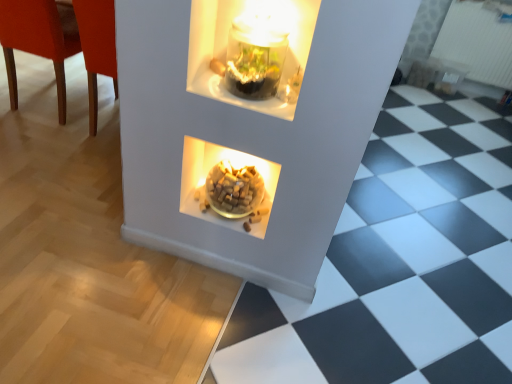
Question: Considering the relative positions of translucent glass bowl at center and matte wood chair at left in the image provided, is translucent glass bowl at center to the left or to the right of matte wood chair at left?

Choices:
 (A) left
 (B) right

Answer: (B)

Question: Considering the positions of point (268, 173) and point (1, 29), is point (268, 173) closer or farther from the camera than point (1, 29)?

Choices:
 (A) farther
 (B) closer

Answer: (B)

Question: Which of these objects is positioned farthest from the matte wood chair at left?

Choices:
 (A) translucent glass bowl at center
 (B) white textured radiator at upper right

Answer: (B)

Question: Considering the real-world distances, which object is closest to the matte wood chair at left?

Choices:
 (A) translucent glass bowl at center
 (B) white textured radiator at upper right

Answer: (A)